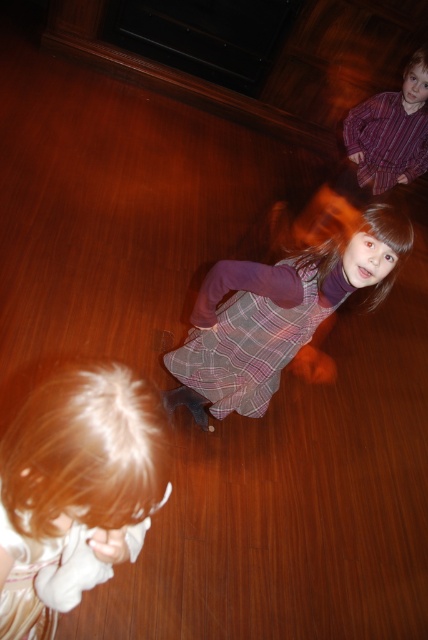
You are a photographer trying to capture a clear shot of the two children in the scene. The camera can focus on objects within a 100 cm range. Can you focus on both the blonde hair at lower left and the plaid fabric dress at center at the same time?

The blonde hair at lower left is 97.09 centimeters from the plaid fabric dress at center. Since the distance between them is within the camera focus range of 100 cm, you can focus on both the blonde hair at lower left and the plaid fabric dress at center simultaneously.

You are a photographer setting up a shoot in this room. You need to position a light source so that it illuminates both the white cotton dress at lower left and the striped cotton shirt at upper right without casting harsh shadows. Based on their positions, where should you place the light source relative to these two objects?

The white cotton dress at lower left is below the striped cotton shirt at upper right, so placing the light source above and between them would ensure even illumination and minimize harsh shadows.

You are a photographer trying to capture a clear shot of the children in the scene. The blonde hair at lower left and the plaid fabric dress at center are both in your viewfinder. Which object should you focus on to ensure it appears taller in the photo?

The plaid fabric dress at center should be focused on to appear taller in the photo because it has a greater height compared to the blonde hair at lower left.